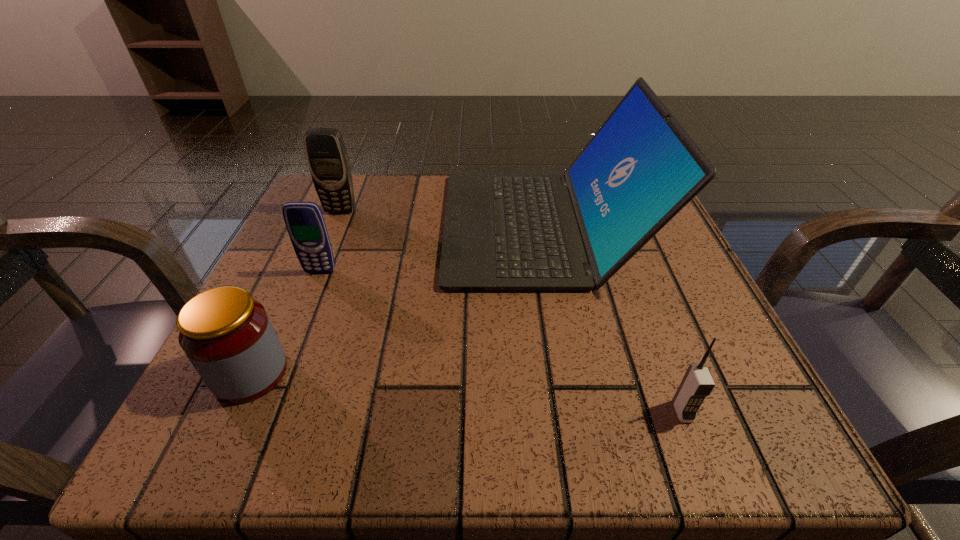
This screenshot has width=960, height=540. In order to click on free space located on the front-facing side of the second nearest cellular telephone in this screenshot , I will do `click(286, 357)`.

The image size is (960, 540). Identify the location of vacant space located 0.060m on the back of the jar. (277, 315).

Identify the location of laptop computer that is at the far edge. The image size is (960, 540). (503, 231).

You are a GUI agent. You are given a task and a screenshot of the screen. Output one action in this format:
    pyautogui.click(x=<x>, y=<y>)
    Task: Click on the cellular telephone present at the far edge
    Image resolution: width=960 pixels, height=540 pixels.
    Given the screenshot: What is the action you would take?
    pyautogui.click(x=328, y=161)

Identify the location of cellular telephone located at the near edge. The image size is (960, 540). (697, 383).

Where is `jar that is at the near edge`? The height and width of the screenshot is (540, 960). jar that is at the near edge is located at coordinates (227, 335).

The width and height of the screenshot is (960, 540). Find the location of `jar that is at the left edge`. jar that is at the left edge is located at coordinates (227, 335).

Where is `laptop computer present at the right edge`? laptop computer present at the right edge is located at coordinates (503, 231).

Find the location of `cellular telephone at the right edge`. cellular telephone at the right edge is located at coordinates (697, 383).

Locate an element on the screen. object positioned at the far left corner is located at coordinates (328, 161).